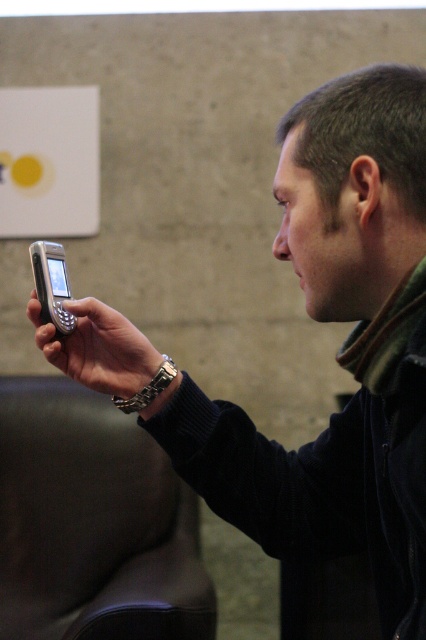
Question: In this image, where is silver metallic phone at center located relative to matte black phone at center?

Choices:
 (A) above
 (B) below

Answer: (B)

Question: Estimate the real-world distances between objects in this image. Which object is closer to the silver metallic phone at center?

Choices:
 (A) matte black phone at center
 (B) leather-like armchair at lower left

Answer: (A)

Question: Among these points, which one is nearest to the camera?

Choices:
 (A) (81, 468)
 (B) (106, 314)

Answer: (B)

Question: Which point is closer to the camera?

Choices:
 (A) silver metallic phone at center
 (B) matte black phone at center

Answer: (A)

Question: Where is silver metallic phone at center located in relation to matte black phone at center in the image?

Choices:
 (A) right
 (B) left

Answer: (A)

Question: Is leather-like armchair at lower left to the left of matte black phone at center from the viewer's perspective?

Choices:
 (A) no
 (B) yes

Answer: (B)